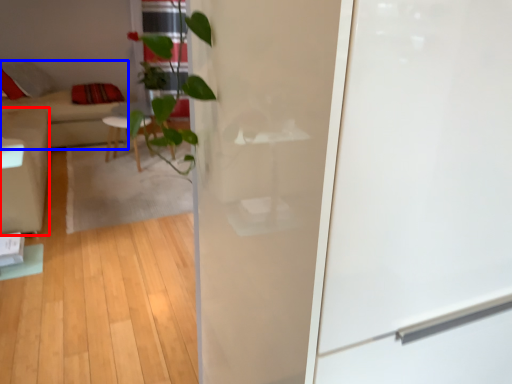
Question: Among these objects, which one is nearest to the camera, armchair (highlighted by a red box) or couch (highlighted by a blue box)?

Choices:
 (A) armchair
 (B) couch

Answer: (A)